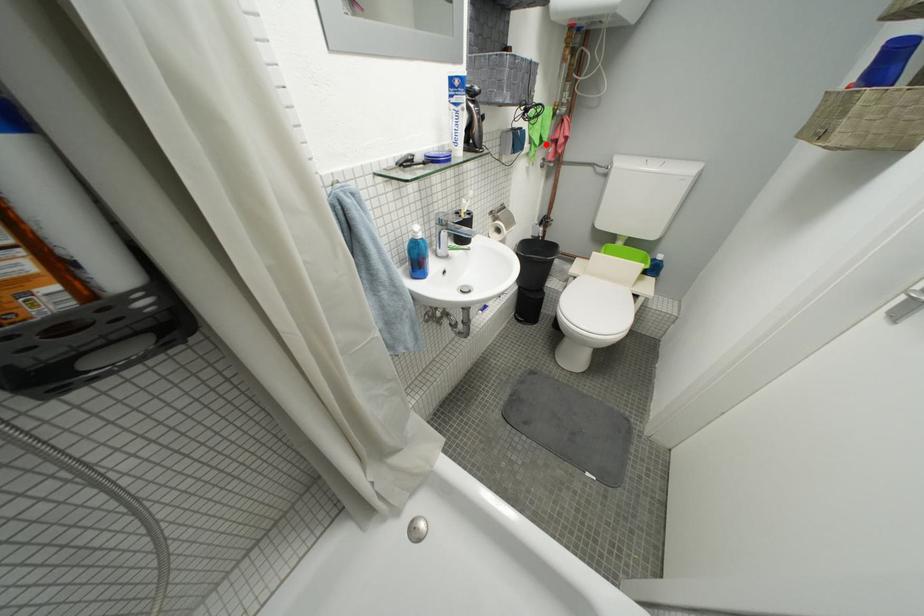
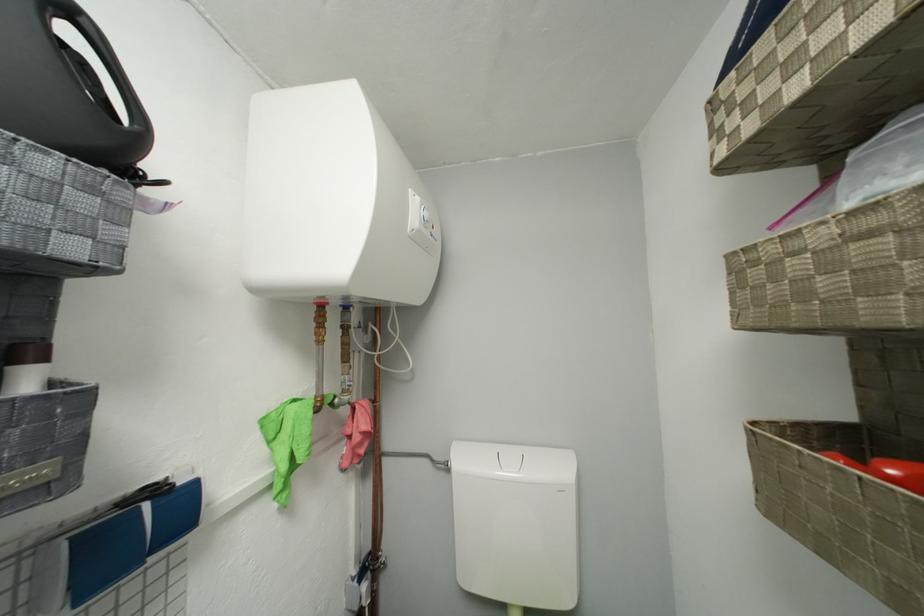
Question: A red point is marked in image1. In image2, is the corresponding 3D point closer to the camera or farther? Reply with the corresponding letter.

Choices:
 (A) The corresponding 3D point is closer.
 (B) The corresponding 3D point is farther.

Answer: (B)